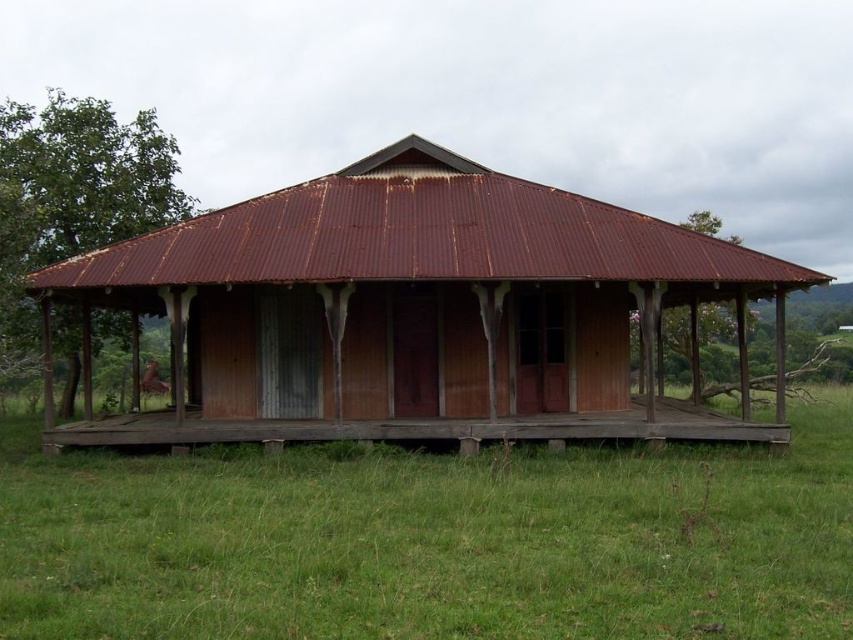
Can you confirm if rusty wood hut at center is positioned to the left of rusty wood porch at center?

Yes, rusty wood hut at center is to the left of rusty wood porch at center.

Which is below, rusty wood hut at center or rusty wood porch at center?

rusty wood porch at center is below.

At what (x,y) coordinates should I click in order to perform the action: click on rusty wood hut at center. Please return your answer as a coordinate pair (x, y). This screenshot has width=853, height=640. Looking at the image, I should click on (415, 312).